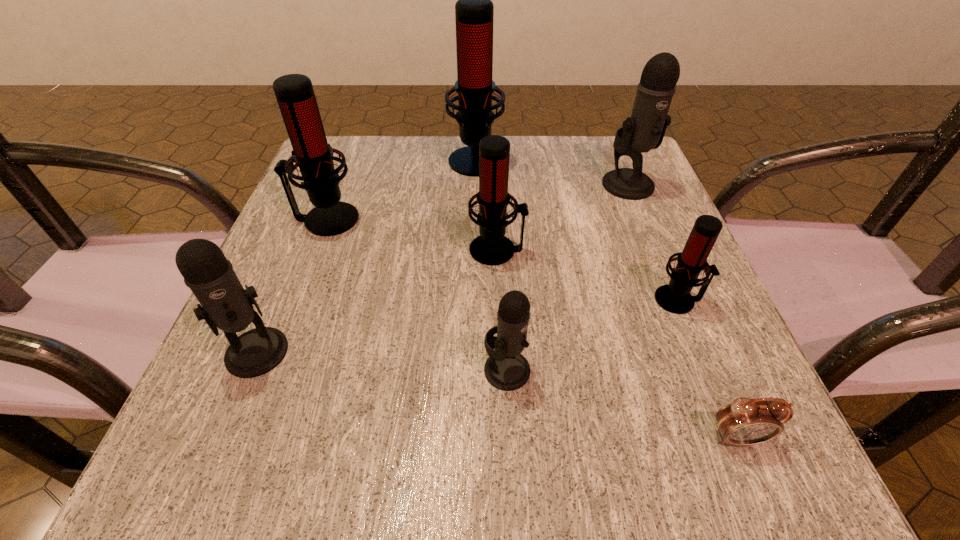
Find the location of a particular element. Image resolution: width=960 pixels, height=540 pixels. empty space that is in between the smallest red microphone and the second smallest red microphone is located at coordinates (588, 275).

Locate an element on the screen. This screenshot has width=960, height=540. vacant point located between the third biggest red microphone and the third smallest red microphone is located at coordinates (412, 234).

Locate an element on the screen. vacant space in between the fourth nearest object and the second smallest black microphone is located at coordinates (468, 326).

This screenshot has height=540, width=960. I want to click on vacant region between the biggest black microphone and the smallest black microphone, so click(x=567, y=277).

Find the location of a particular element. This screenshot has width=960, height=540. vacant area that lies between the leftmost black microphone and the biggest black microphone is located at coordinates (443, 268).

This screenshot has height=540, width=960. I want to click on free space between the third biggest red microphone and the rightmost black microphone, so click(x=563, y=217).

Choose which object is the fifth nearest neighbor to the smallest red microphone. Please provide its 2D coordinates. Your answer should be formatted as a tuple, i.e. [(x, y)], where the tuple contains the x and y coordinates of a point satisfying the conditions above.

[(474, 11)]

Identify the location of the seventh closest object relative to the second black microphone from right to left. This screenshot has width=960, height=540. (474, 11).

Identify which microphone is located as the second nearest to the smallest red microphone. Please provide its 2D coordinates. Your answer should be formatted as a tuple, i.e. [(x, y)], where the tuple contains the x and y coordinates of a point satisfying the conditions above.

[(506, 369)]

The image size is (960, 540). What are the coordinates of `microphone that stands as the fourth closest to the leftmost black microphone` in the screenshot? It's located at (474, 11).